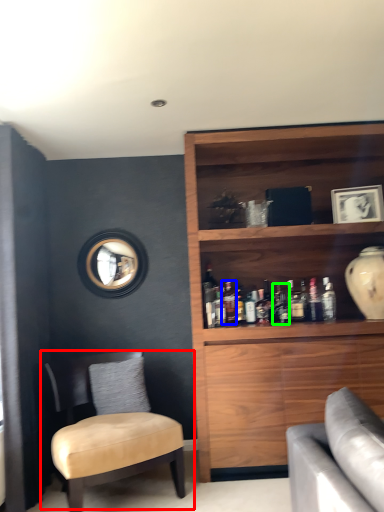
Question: Based on their relative distances, which object is farther from chair (highlighted by a red box)? Choose from bottle (highlighted by a blue box) and bottle (highlighted by a green box).

Choices:
 (A) bottle
 (B) bottle

Answer: (B)